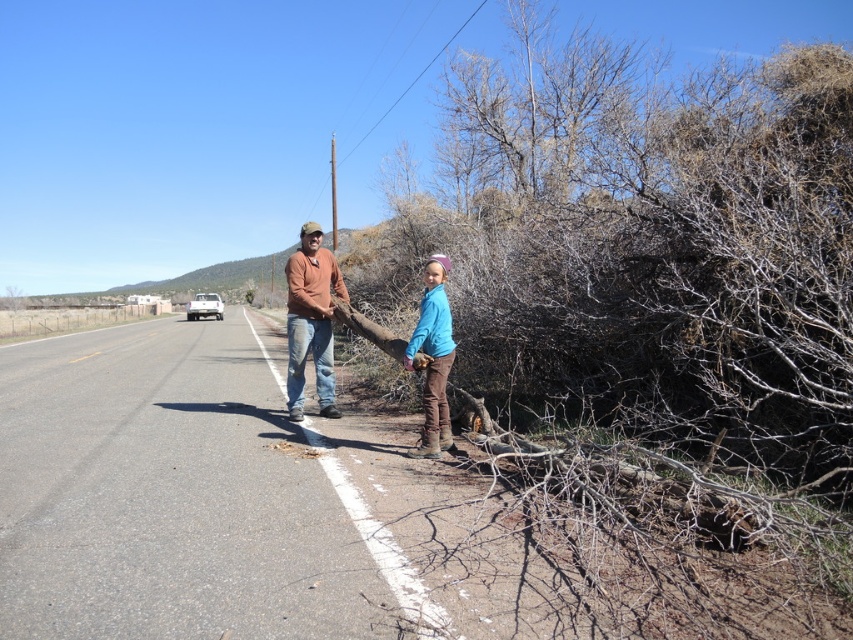
Between asphalt road at center and matte brown shirt at center, which one appears on the left side from the viewer's perspective?

Positioned to the left is asphalt road at center.

Which is in front, point (184, 452) or point (306, 305)?

Positioned in front is point (184, 452).

The image size is (853, 640). What do you see at coordinates (181, 497) in the screenshot?
I see `asphalt road at center` at bounding box center [181, 497].

At what (x,y) coordinates should I click in order to perform the action: click on asphalt road at center. Please return your answer as a coordinate pair (x, y). This screenshot has height=640, width=853. Looking at the image, I should click on (181, 497).

Is point (189, 456) farther from camera compared to point (444, 385)?

Yes.

At what (x,y) coordinates should I click in order to perform the action: click on asphalt road at center. Please return your answer as a coordinate pair (x, y). Image resolution: width=853 pixels, height=640 pixels. Looking at the image, I should click on (181, 497).

Can you confirm if brown dry wood at right is taller than blue fleece jacket at center?

Indeed, brown dry wood at right has a greater height compared to blue fleece jacket at center.

Does point (802, 432) come farther from viewer compared to point (442, 339)?

No, it is in front of (442, 339).

Locate an element on the screen. brown dry wood at right is located at coordinates (651, 316).